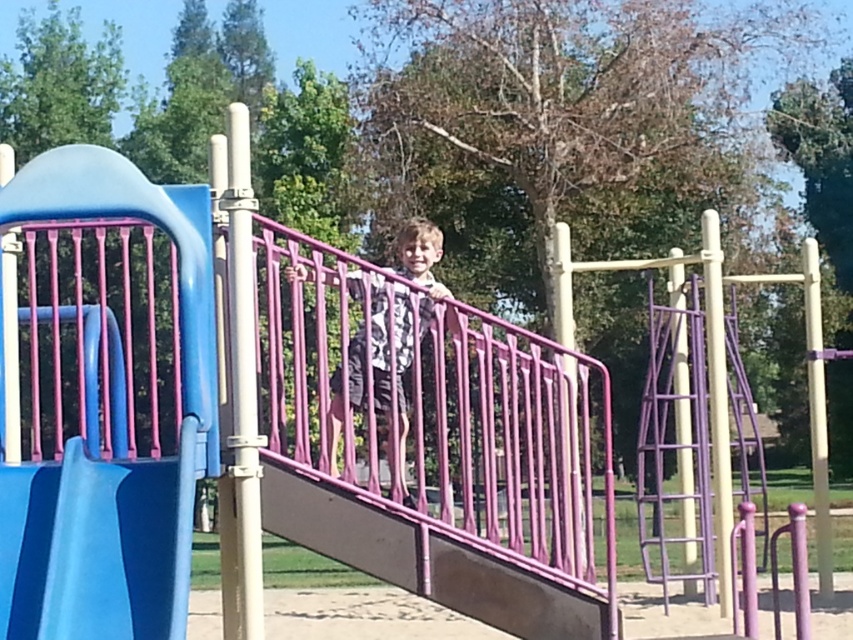
Does smooth plastic slide at left have a lesser width compared to matte pink railing at center?

Incorrect, smooth plastic slide at left's width is not less than matte pink railing at center's.

Locate an element on the screen. smooth plastic slide at left is located at coordinates (96, 545).

Who is more distant from viewer, (79, 588) or (349, 273)?

The point (349, 273) is more distant.

Locate an element on the screen. smooth plastic slide at left is located at coordinates (96, 545).